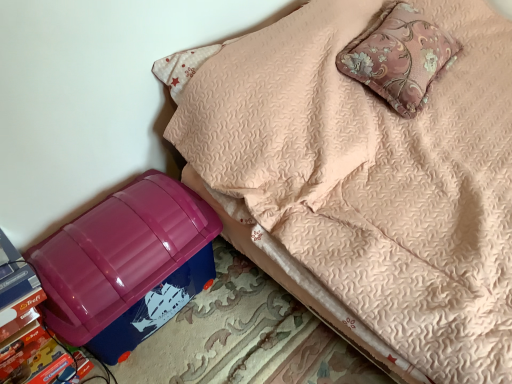
Question: Considering the relative sizes of blue plastic storage bin at lower left and pink floral cushion at upper right in the image provided, is blue plastic storage bin at lower left shorter than pink floral cushion at upper right?

Choices:
 (A) yes
 (B) no

Answer: (B)

Question: Is blue plastic storage bin at lower left not inside pink floral cushion at upper right?

Choices:
 (A) yes
 (B) no

Answer: (A)

Question: Is blue plastic storage bin at lower left smaller than pink floral cushion at upper right?

Choices:
 (A) yes
 (B) no

Answer: (B)

Question: Could pink floral cushion at upper right be considered to be inside blue plastic storage bin at lower left?

Choices:
 (A) yes
 (B) no

Answer: (A)

Question: Is blue plastic storage bin at lower left to the left of pink floral cushion at upper right from the viewer's perspective?

Choices:
 (A) yes
 (B) no

Answer: (B)

Question: In terms of width, does blue plastic storage bin at lower left look wider or thinner when compared to pink floral cushion at upper right?

Choices:
 (A) wide
 (B) thin

Answer: (A)

Question: From the image's perspective, is blue plastic storage bin at lower left above or below pink floral cushion at upper right?

Choices:
 (A) above
 (B) below

Answer: (B)

Question: Looking at the image, does blue plastic storage bin at lower left seem bigger or smaller compared to pink floral cushion at upper right?

Choices:
 (A) small
 (B) big

Answer: (B)

Question: Do you think blue plastic storage bin at lower left is within pink floral cushion at upper right, or outside of it?

Choices:
 (A) inside
 (B) outside

Answer: (B)

Question: From a real-world perspective, is blue plastic storage bin at lower left above or below glossy plastic storage box at lower left?

Choices:
 (A) below
 (B) above

Answer: (B)

Question: In the image, is blue plastic storage bin at lower left positioned in front of or behind glossy plastic storage box at lower left?

Choices:
 (A) behind
 (B) front

Answer: (B)

Question: Based on their positions, is blue plastic storage bin at lower left located to the left or right of glossy plastic storage box at lower left?

Choices:
 (A) right
 (B) left

Answer: (A)

Question: Based on their sizes in the image, would you say blue plastic storage bin at lower left is bigger or smaller than glossy plastic storage box at lower left?

Choices:
 (A) big
 (B) small

Answer: (A)

Question: Based on their positions, is glossy plastic storage box at lower left located to the left or right of pink floral cushion at upper right?

Choices:
 (A) right
 (B) left

Answer: (B)

Question: Considering the positions of point (121, 256) and point (428, 38), is point (121, 256) closer or farther from the camera than point (428, 38)?

Choices:
 (A) closer
 (B) farther

Answer: (A)